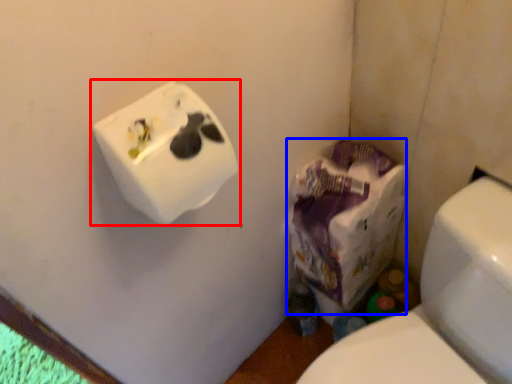
Question: Which object is further to the camera taking this photo, toilet paper (highlighted by a red box) or paper bag (highlighted by a blue box)?

Choices:
 (A) toilet paper
 (B) paper bag

Answer: (B)